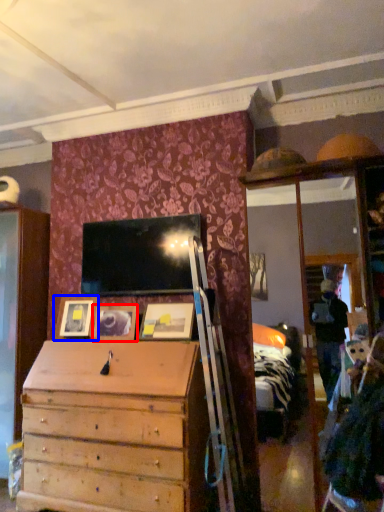
Question: Among these objects, which one is nearest to the camera, picture frame (highlighted by a red box) or picture frame (highlighted by a blue box)?

Choices:
 (A) picture frame
 (B) picture frame

Answer: (A)